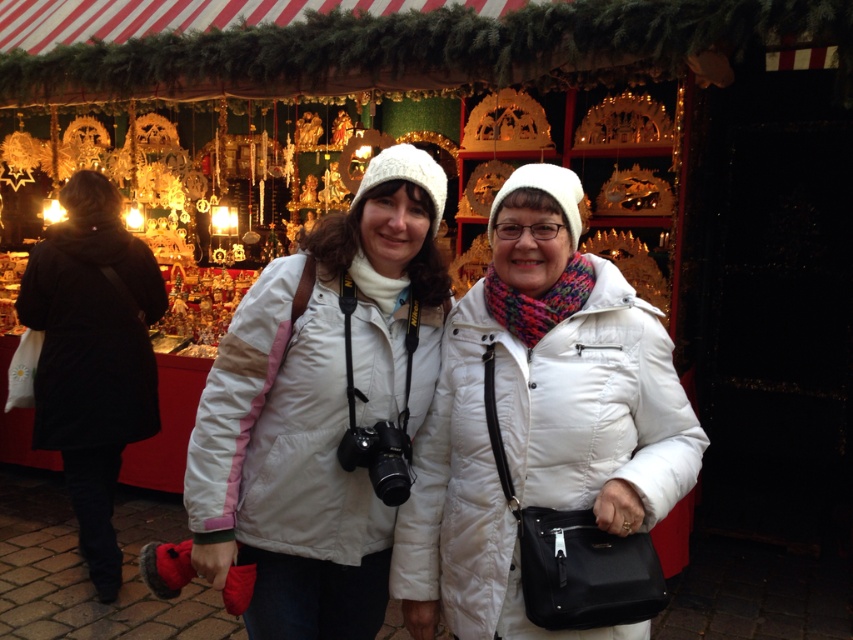
How far apart are white puffy jacket at center and black matte coat at left?

white puffy jacket at center is 9.51 feet from black matte coat at left.

Describe the element at coordinates (538, 419) in the screenshot. I see `white puffy jacket at center` at that location.

Between point (479, 582) and point (138, 376), which one is positioned behind?

The point (138, 376) is more distant.

Find the location of a particular element. white puffy jacket at center is located at coordinates (538, 419).

Is white matte jacket at center bigger than black matte coat at left?

Incorrect, white matte jacket at center is not larger than black matte coat at left.

Which of these two, white matte jacket at center or black matte coat at left, stands shorter?

Standing shorter between the two is white matte jacket at center.

Where is `white matte jacket at center`? white matte jacket at center is located at coordinates (318, 410).

Is white puffy jacket at center shorter than white matte jacket at center?

Yes, white puffy jacket at center is shorter than white matte jacket at center.

Which is above, white puffy jacket at center or white matte jacket at center?

white matte jacket at center

Find the location of a particular element. Image resolution: width=853 pixels, height=640 pixels. white puffy jacket at center is located at coordinates (538, 419).